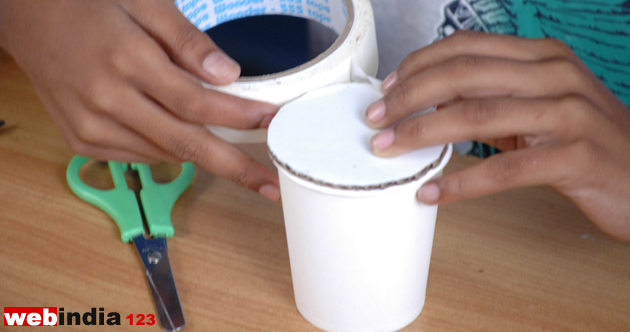
Find the location of a particular element. brown spot on table is located at coordinates (4, 127).